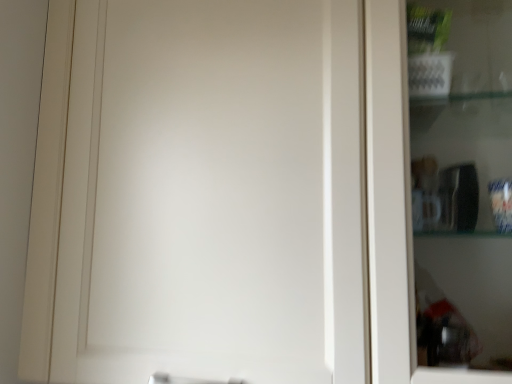
Image resolution: width=512 pixels, height=384 pixels. I want to click on white matte door at center, so (212, 193).

Describe the element at coordinates (212, 193) in the screenshot. I see `white matte door at center` at that location.

Where is `white matte door at center`? The width and height of the screenshot is (512, 384). white matte door at center is located at coordinates (212, 193).